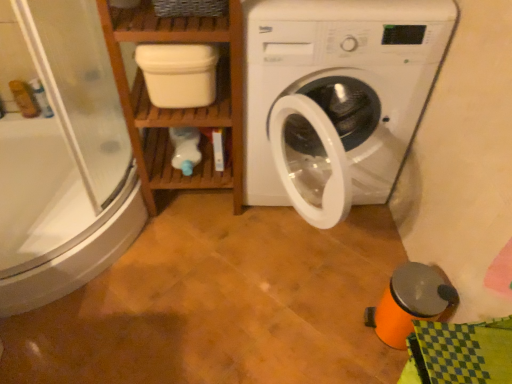
Where is `blank area beneath white plastic washing machine at center (from a real-world perspective)`? blank area beneath white plastic washing machine at center (from a real-world perspective) is located at coordinates (324, 241).